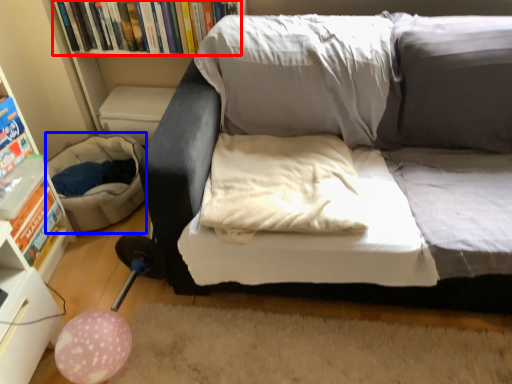
Question: Which of the following is the closest to the observer, book (highlighted by a red box) or bean bag chair (highlighted by a blue box)?

Choices:
 (A) book
 (B) bean bag chair

Answer: (B)